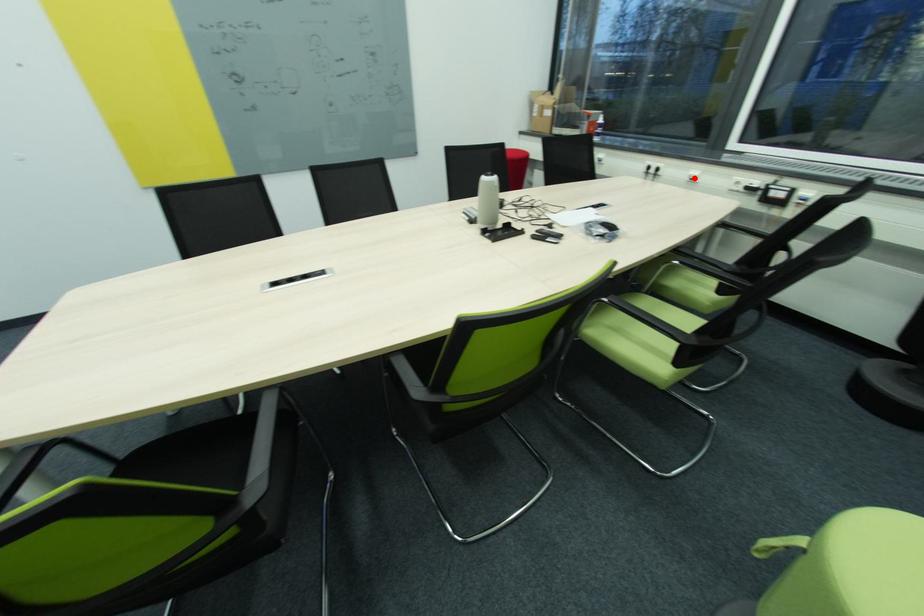
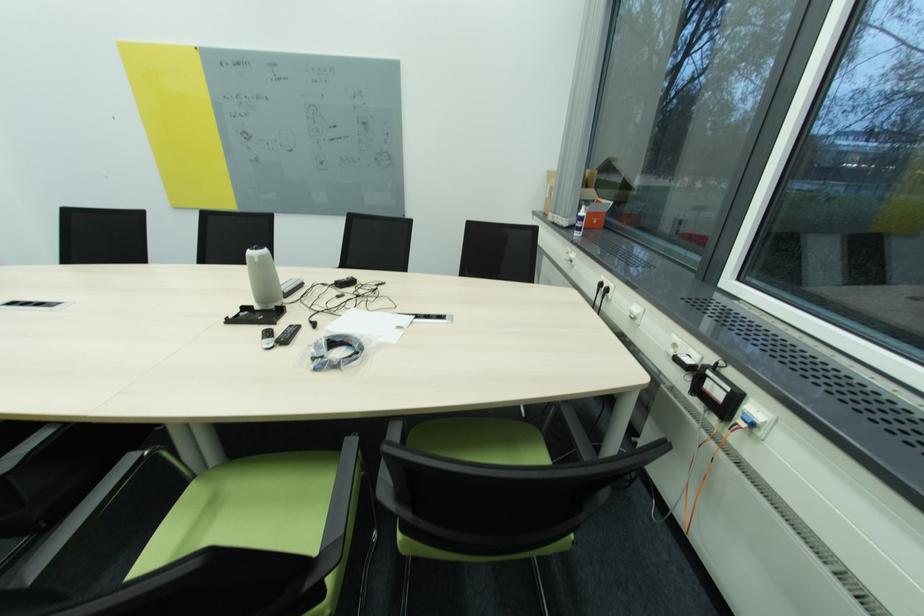
Locate, in the second image, the point that corresponds to the highlighted location in the first image.

(636, 314)